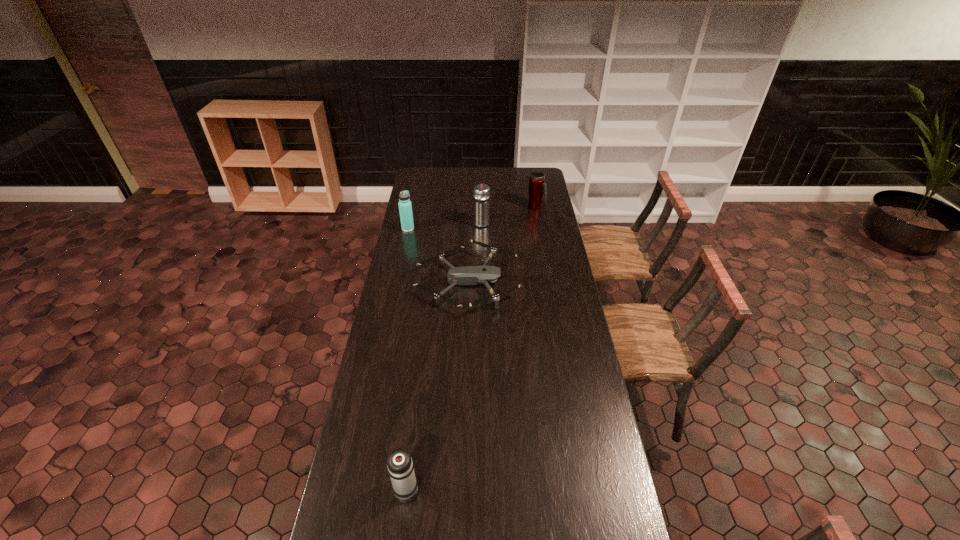
In the image, there is a desktop. Where is `vacant space at the right edge`? This screenshot has width=960, height=540. vacant space at the right edge is located at coordinates (546, 269).

What are the coordinates of `vacant space at the far left corner of the desktop` in the screenshot? It's located at (424, 177).

Locate an element on the screen. The height and width of the screenshot is (540, 960). vacant space at the far right corner of the desktop is located at coordinates (524, 180).

Locate an element on the screen. The height and width of the screenshot is (540, 960). free space between the second thermos bottle from left to right and the leftmost object is located at coordinates (407, 357).

This screenshot has height=540, width=960. Find the location of `free space between the farthest thermos bottle and the shortest thermos bottle`. free space between the farthest thermos bottle and the shortest thermos bottle is located at coordinates (470, 347).

At what (x,y) coordinates should I click in order to perform the action: click on free area in between the shortest thermos bottle and the leftmost thermos bottle. Please return your answer as a coordinate pair (x, y). Looking at the image, I should click on (407, 357).

Locate an element on the screen. free space between the second thermos bottle from left to right and the second thermos bottle from right to left is located at coordinates (444, 354).

Find the location of `vacant space in between the second thermos bottle from right to left and the fourth farthest object`. vacant space in between the second thermos bottle from right to left and the fourth farthest object is located at coordinates 474,252.

This screenshot has width=960, height=540. Identify the location of free area in between the farthest thermos bottle and the third thermos bottle from left to right. (509, 215).

Where is `vacant area between the leftmost thermos bottle and the second shortest object`? The width and height of the screenshot is (960, 540). vacant area between the leftmost thermos bottle and the second shortest object is located at coordinates (407, 357).